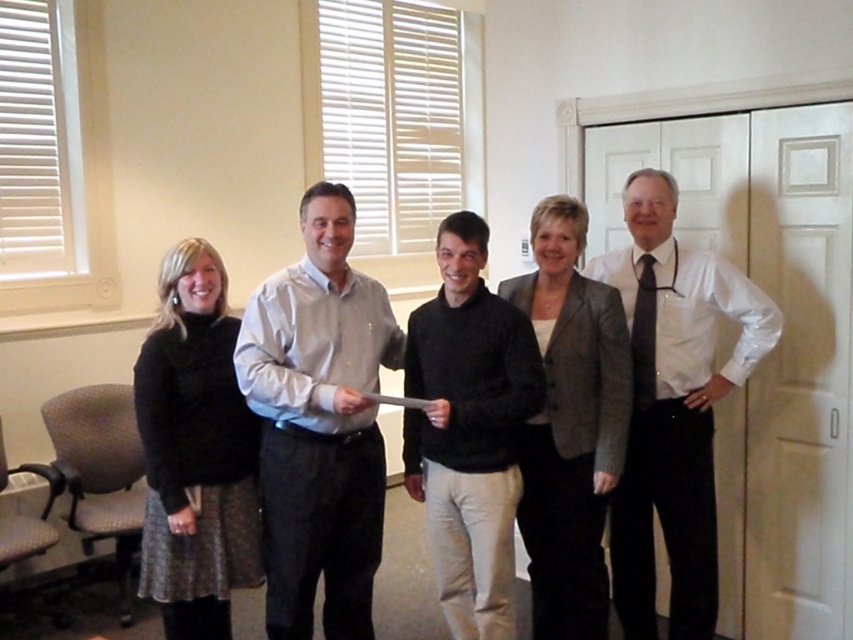
Question: Which of these objects is positioned farthest from the white glossy shirt at right?

Choices:
 (A) black matte sweater at center
 (B) light gray shirt at center
 (C) gray textured blazer at center

Answer: (B)

Question: Which object appears farthest from the camera in this image?

Choices:
 (A) light gray shirt at center
 (B) black textured sweater at left
 (C) black sweater at center
 (D) dark blue silk tie at right

Answer: (D)

Question: Is white glossy shirt at right wider than black sweater at center?

Choices:
 (A) no
 (B) yes

Answer: (B)

Question: Can you confirm if light gray shirt at center is bigger than white glossy shirt at right?

Choices:
 (A) yes
 (B) no

Answer: (B)

Question: Does light gray shirt at center have a smaller size compared to white glossy shirt at right?

Choices:
 (A) yes
 (B) no

Answer: (A)

Question: Which object is closer to the camera taking this photo?

Choices:
 (A) light gray shirt at center
 (B) black sweater at center
 (C) white glossy shirt at right
 (D) dark blue silk tie at right

Answer: (A)